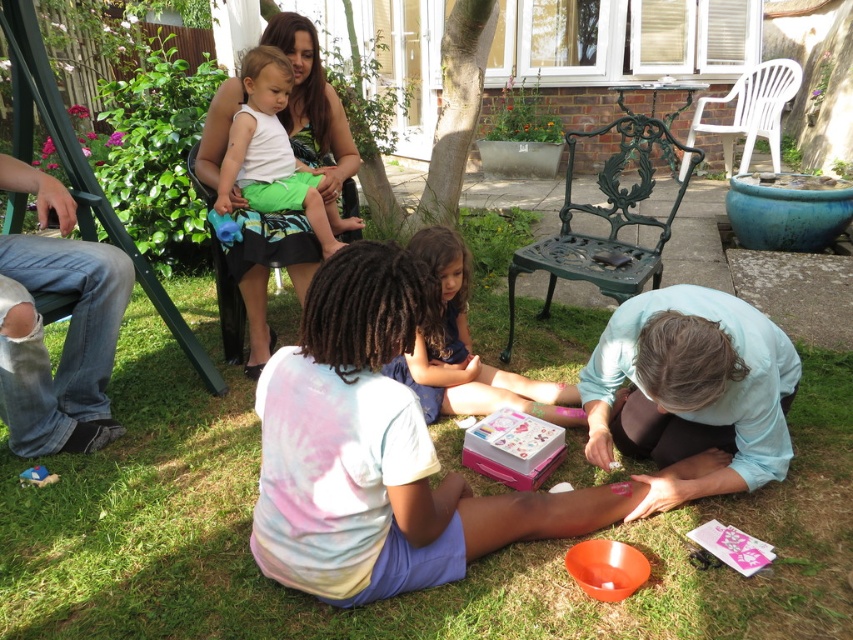
You are a photographer trying to capture a candid shot of the people in the scene. You notice the light blue fabric at lower right and the white matte shirt at upper center. Which object is positioned lower in the frame?

The light blue fabric at lower right is positioned lower in the frame than the white matte shirt at upper center.

You are trying to decide which item to use to cover a small picnic basket. The light blue fabric at lower right and the ripped denim jeans at lower left are available. Which one is wider and thus better suited for covering the basket?

The light blue fabric at lower right is wider than the ripped denim jeans at lower left, making it better suited for covering the picnic basket.

You are a gardener who wants to plant a new flower bed in the backyard. You have two areas to choose from the green grass at lower center and the ripped denim jeans at lower left. Which area would you choose for planting, and why?

The green grass at lower center has a lesser height compared to the ripped denim jeans at lower left. Therefore, the green grass at lower center is more suitable for planting since it is lower and likely part of the actual ground, whereas the ripped denim jeans are objects on top of the ground and not suitable for planting.